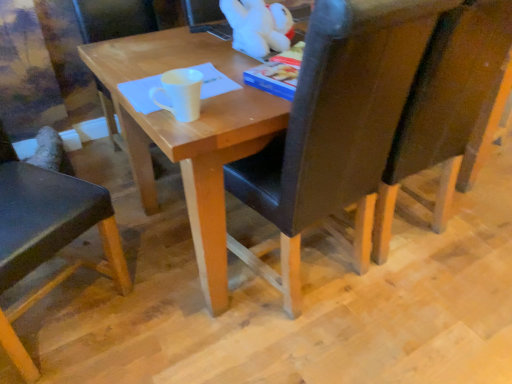
Question: Is black leather chair at center, which is counted as the second chair, starting from the right, smaller than dark brown leather chair at right, the fourth chair positioned from the left?

Choices:
 (A) yes
 (B) no

Answer: (B)

Question: Would you consider black leather chair at center, which is counted as the second chair, starting from the right, to be distant from dark brown leather chair at right, the fourth chair positioned from the left?

Choices:
 (A) no
 (B) yes

Answer: (A)

Question: From a real-world perspective, is black leather chair at center, which is counted as the second chair, starting from the right, physically below dark brown leather chair at right, the first chair when ordered from right to left?

Choices:
 (A) no
 (B) yes

Answer: (A)

Question: Considering the relative sizes of black leather chair at center, which is counted as the second chair, starting from the right, and dark brown leather chair at right, the first chair when ordered from right to left, in the image provided, is black leather chair at center, which is counted as the second chair, starting from the right, bigger than dark brown leather chair at right, the first chair when ordered from right to left,?

Choices:
 (A) no
 (B) yes

Answer: (B)

Question: From the image's perspective, is black leather chair at center, the third chair viewed from the left, on dark brown leather chair at right, the fourth chair positioned from the left?

Choices:
 (A) yes
 (B) no

Answer: (B)

Question: From the image's perspective, is matte black chair at left, arranged as the 1th chair when viewed from the left, positioned above or below matte wood chair at center, arranged as the 3th chair when viewed from the right?

Choices:
 (A) above
 (B) below

Answer: (B)

Question: From a real-world perspective, is matte black chair at left, arranged as the 1th chair when viewed from the left, physically located above or below matte wood chair at center, arranged as the 3th chair when viewed from the right?

Choices:
 (A) above
 (B) below

Answer: (A)

Question: Considering the positions of point click(49, 225) and point click(179, 13), is point click(49, 225) closer or farther from the camera than point click(179, 13)?

Choices:
 (A) farther
 (B) closer

Answer: (B)

Question: In terms of size, does matte black chair at left, the 4th chair from the right, appear bigger or smaller than matte wood chair at center, which ranks as the second chair in left-to-right order?

Choices:
 (A) big
 (B) small

Answer: (A)

Question: Is point (71, 208) closer or farther from the camera than point (422, 135)?

Choices:
 (A) closer
 (B) farther

Answer: (A)

Question: From their relative heights in the image, would you say matte black chair at left, arranged as the 1th chair when viewed from the left, is taller or shorter than dark brown leather chair at right, the first chair when ordered from right to left?

Choices:
 (A) tall
 (B) short

Answer: (A)

Question: Based on their sizes in the image, would you say matte black chair at left, arranged as the 1th chair when viewed from the left, is bigger or smaller than dark brown leather chair at right, the first chair when ordered from right to left?

Choices:
 (A) big
 (B) small

Answer: (A)

Question: Considering the positions of matte black chair at left, arranged as the 1th chair when viewed from the left, and dark brown leather chair at right, the first chair when ordered from right to left, in the image, is matte black chair at left, arranged as the 1th chair when viewed from the left, wider or thinner than dark brown leather chair at right, the first chair when ordered from right to left,?

Choices:
 (A) thin
 (B) wide

Answer: (B)

Question: Is white matte mug at center inside the boundaries of matte wood chair at center, which ranks as the second chair in left-to-right order, or outside?

Choices:
 (A) outside
 (B) inside

Answer: (A)

Question: Considering the positions of white matte mug at center and matte wood chair at center, arranged as the 3th chair when viewed from the right, in the image, is white matte mug at center taller or shorter than matte wood chair at center, arranged as the 3th chair when viewed from the right,?

Choices:
 (A) short
 (B) tall

Answer: (A)